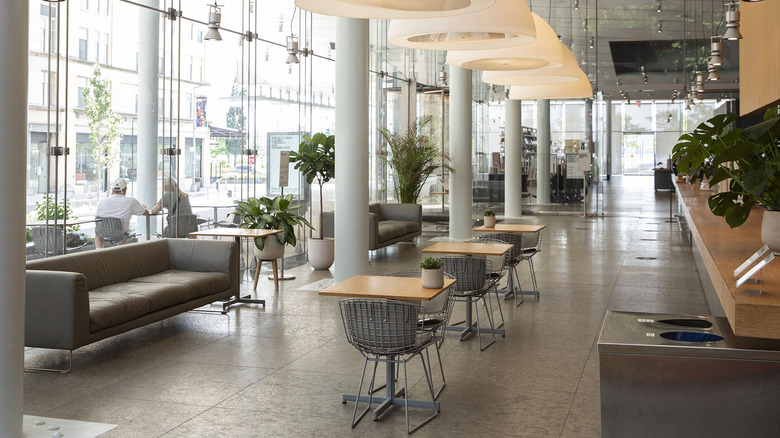
The height and width of the screenshot is (438, 780). In order to click on table supports in this screenshot , I will do `click(390, 402)`, `click(472, 323)`, `click(512, 286)`, `click(242, 297)`.